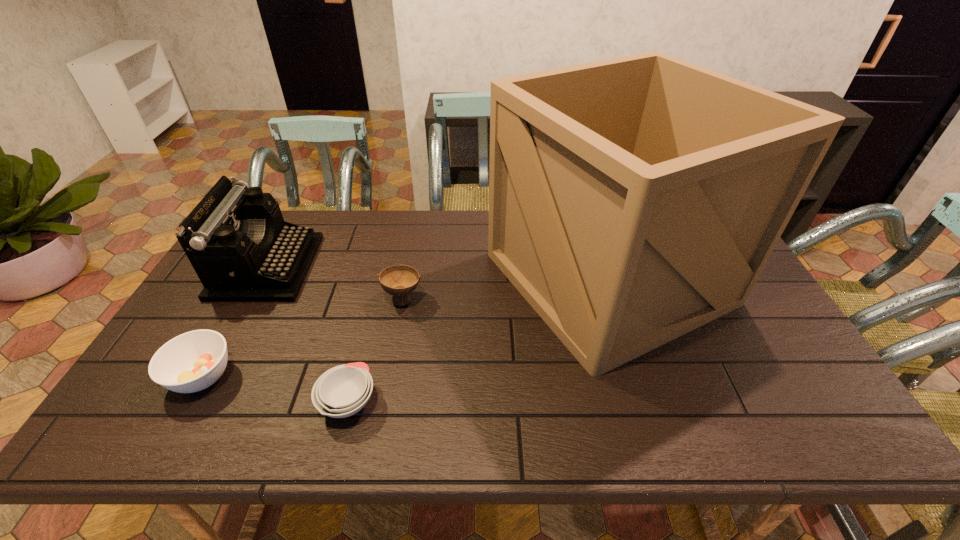
Find the location of a particular element. The width and height of the screenshot is (960, 540). free space between the typewriter and the shortest object is located at coordinates (307, 334).

You are a GUI agent. You are given a task and a screenshot of the screen. Output one action in this format:
    pyautogui.click(x=<x>, y=<y>)
    Task: Click on the free space between the shortest soup bowl and the farthest soup bowl
    Image resolution: width=960 pixels, height=540 pixels.
    Given the screenshot: What is the action you would take?
    pyautogui.click(x=375, y=350)

You are a GUI agent. You are given a task and a screenshot of the screen. Output one action in this format:
    pyautogui.click(x=<x>, y=<y>)
    Task: Click on the vacant area that lies between the tallest object and the second tallest object
    
    Given the screenshot: What is the action you would take?
    pyautogui.click(x=438, y=272)

The height and width of the screenshot is (540, 960). I want to click on vacant space that's between the typewriter and the tallest soup bowl, so click(335, 283).

Find the location of a particular element. vacant area that lies between the second shortest soup bowl and the tallest object is located at coordinates (405, 327).

Identify which object is the second closest to the shortest object. Please provide its 2D coordinates. Your answer should be formatted as a tuple, i.e. [(x, y)], where the tuple contains the x and y coordinates of a point satisfying the conditions above.

[(193, 361)]

I want to click on object that is the third closest to the second tallest soup bowl, so click(x=399, y=280).

Identify the location of soup bowl identified as the second closest to the third tallest object. (193, 361).

The width and height of the screenshot is (960, 540). I want to click on soup bowl that is the closest to the tallest object, so click(399, 280).

I want to click on blank area in the image that satisfies the following two spatial constraints: 1. on the typing side of the third tallest object; 2. on the right side of the second tallest object, so click(250, 299).